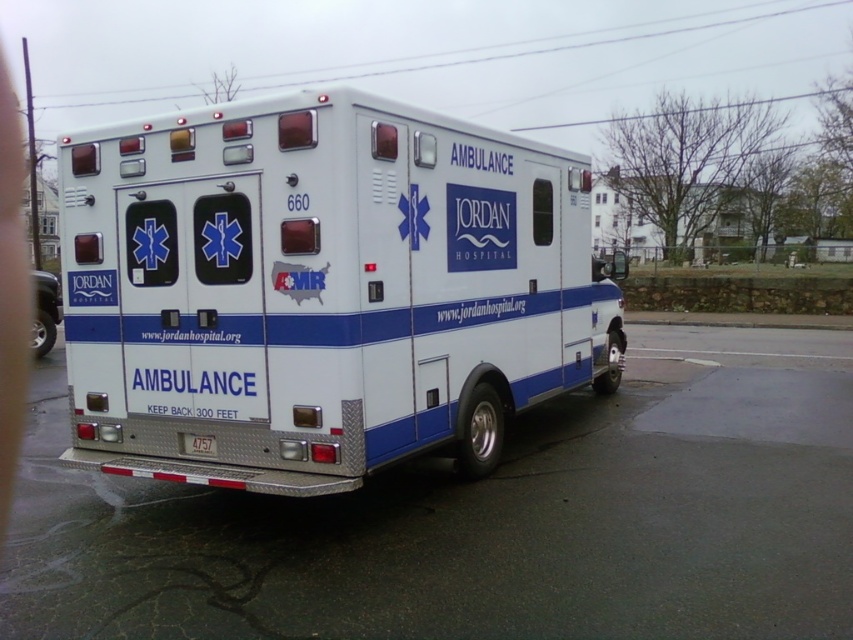
You are standing in front of the ambulance and want to know which point is closer to you. The points are located at coordinates point (55, 323) and point (196, 435). Which point is closer to you?

Point (55, 323) is closer to you because it is further to the viewer than point (196, 435).

You are standing at the point marked by coordinates point (x=322, y=289). Based on the scene, what object are you at the center of?

The point (x=322, y=289) marks the white metallic ambulance at center.

You are a traffic officer directing vehicles on a rainy day. You see the white metallic ambulance at center. Where is the ambulance located in terms of coordinates?

The white metallic ambulance at center is located at coordinates point [322,289].